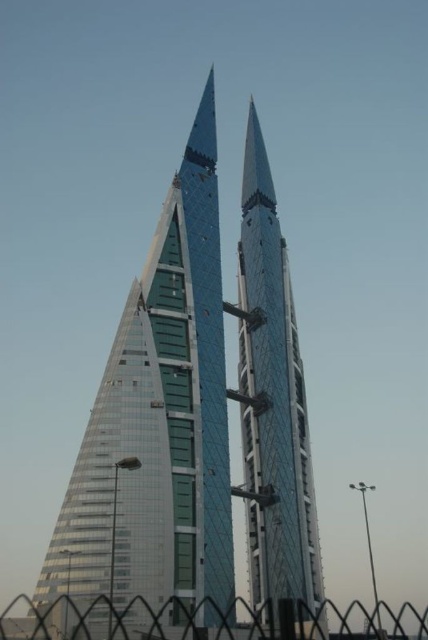
Is transparent glass spire at center bigger than metallic chain-link fence at lower center?

No, transparent glass spire at center is not bigger than metallic chain-link fence at lower center.

Which is more to the left, transparent glass spire at center or metallic chain-link fence at lower center?

metallic chain-link fence at lower center is more to the left.

Describe the element at coordinates (273, 400) in the screenshot. Image resolution: width=428 pixels, height=640 pixels. I see `transparent glass spire at center` at that location.

The width and height of the screenshot is (428, 640). I want to click on transparent glass spire at center, so click(273, 400).

Who is higher up, glassy steel skyscraper at center or transparent glass spire at center?

glassy steel skyscraper at center is higher up.

Does glassy steel skyscraper at center have a smaller size compared to transparent glass spire at center?

Incorrect, glassy steel skyscraper at center is not smaller in size than transparent glass spire at center.

The image size is (428, 640). I want to click on glassy steel skyscraper at center, so click(160, 419).

Is glassy steel skyscraper at center further to camera compared to metallic chain-link fence at lower center?

Yes, glassy steel skyscraper at center is behind metallic chain-link fence at lower center.

Which is in front, point (210, 320) or point (290, 602)?

Positioned in front is point (290, 602).

Does point (152, 580) lie in front of point (395, 614)?

Yes, point (152, 580) is in front of point (395, 614).

Find the location of `glassy steel skyscraper at center`. glassy steel skyscraper at center is located at coordinates (160, 419).